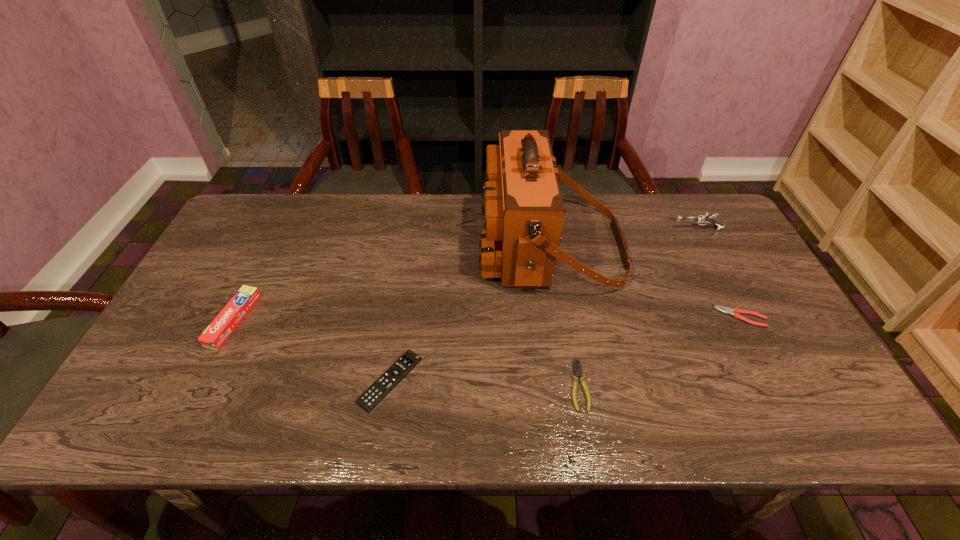
At what (x,y) coordinates should I click in order to perform the action: click on satchel. Please return your answer as a coordinate pair (x, y). This screenshot has height=540, width=960. Looking at the image, I should click on (522, 202).

Identify the location of the second tallest object. This screenshot has height=540, width=960. (704, 219).

The image size is (960, 540). Identify the location of toothpaste. (215, 335).

The width and height of the screenshot is (960, 540). In order to click on the fourth shortest object in this screenshot , I will do `click(215, 335)`.

Locate an element on the screen. The width and height of the screenshot is (960, 540). the farther pliers is located at coordinates (736, 312).

The image size is (960, 540). I want to click on the fifth object from right to left, so click(390, 378).

Where is `the nearer pliers`? the nearer pliers is located at coordinates (577, 372).

Find the location of `free point located 0.400m on the face side of the satchel`. free point located 0.400m on the face side of the satchel is located at coordinates (348, 247).

The width and height of the screenshot is (960, 540). Find the location of `free space located 0.310m on the face side of the satchel`. free space located 0.310m on the face side of the satchel is located at coordinates (378, 247).

You are a GUI agent. You are given a task and a screenshot of the screen. Output one action in this format:
    pyautogui.click(x=<x>, y=<y>)
    Task: Click on the vacant space located on the face side of the satchel
    
    Given the screenshot: What is the action you would take?
    pyautogui.click(x=426, y=247)